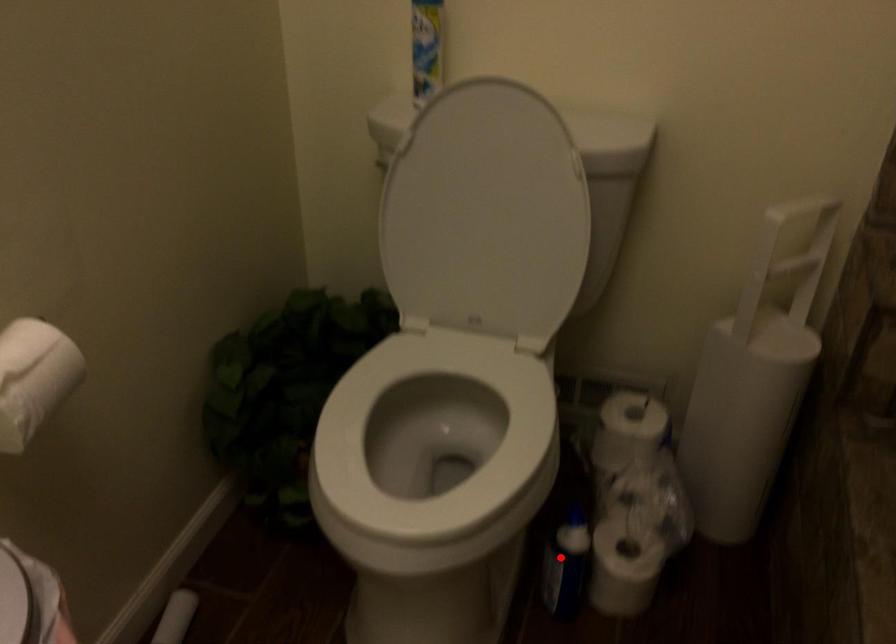
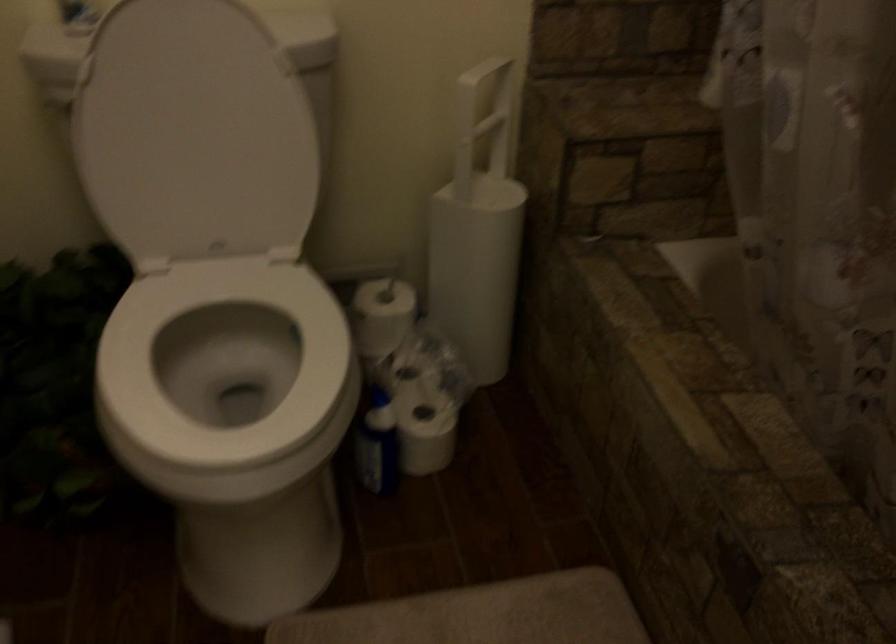
In the second image, find the point that corresponds to the highlighted location in the first image.

(375, 442)